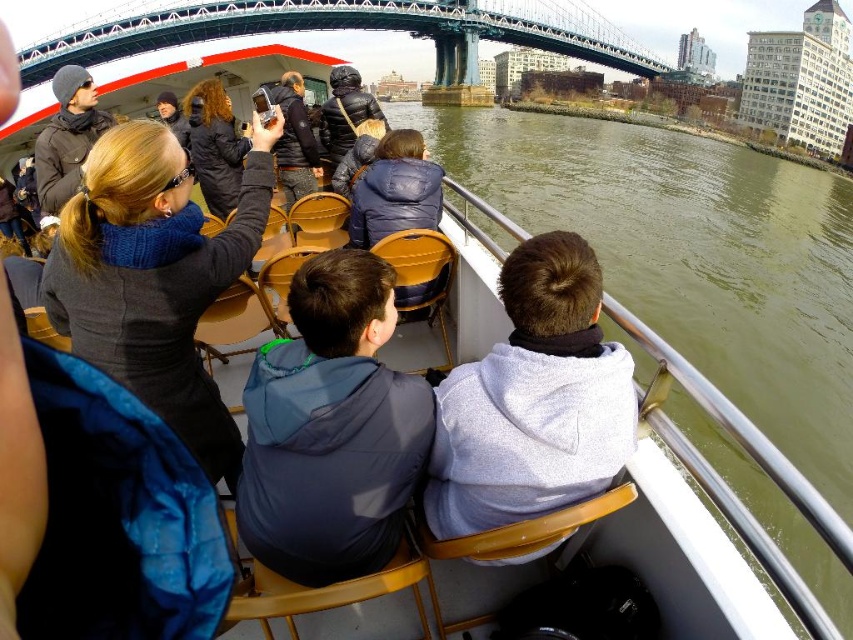
Does greenish water at center have a smaller size compared to matte black jacket at left?

No.

Image resolution: width=853 pixels, height=640 pixels. Find the location of `greenish water at center`. greenish water at center is located at coordinates (692, 253).

Is point (196, 436) farther from camera compared to point (606, 456)?

That is True.

Does dark gray sweater at upper left have a greater height compared to gray fleece jacket at center?

Yes, dark gray sweater at upper left is taller than gray fleece jacket at center.

Find the location of a particular element. dark gray sweater at upper left is located at coordinates (155, 276).

This screenshot has height=640, width=853. Find the location of `dark gray sweater at upper left`. dark gray sweater at upper left is located at coordinates (155, 276).

Between black fuzzy jacket at upper center and dark blue jacket at center, which one is positioned higher?

dark blue jacket at center

Can you confirm if black fuzzy jacket at upper center is shorter than dark blue jacket at center?

Incorrect, black fuzzy jacket at upper center's height does not fall short of dark blue jacket at center's.

I want to click on black fuzzy jacket at upper center, so click(x=213, y=145).